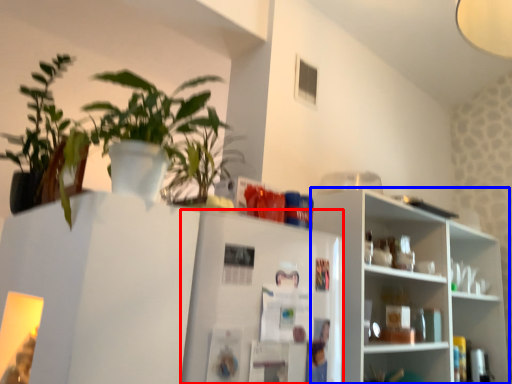
Question: Which object is further to the camera taking this photo, fridge (highlighted by a red box) or shelf (highlighted by a blue box)?

Choices:
 (A) fridge
 (B) shelf

Answer: (B)